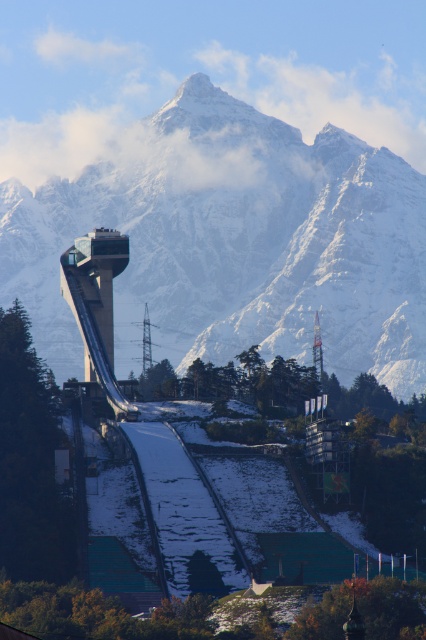
Is point (405, 163) positioned after point (175, 593)?

Yes, point (405, 163) is farther from viewer.

Between snowy granite mountain range at center and snowy white ski slope at center, which one is positioned higher?

snowy granite mountain range at center

Is point (296, 131) behind point (192, 589)?

Yes, point (296, 131) is farther from viewer.

Find the location of `snowy granite mountain range at center`. snowy granite mountain range at center is located at coordinates (238, 244).

Is snowy white ski slope at center to the left of metallic transmission tower at center from the viewer's perspective?

In fact, snowy white ski slope at center is to the right of metallic transmission tower at center.

Which is more to the right, snowy white ski slope at center or metallic transmission tower at center?

snowy white ski slope at center

I want to click on snowy white ski slope at center, so click(x=184, y=515).

Which is behind, point (5, 256) or point (117, 236)?

Positioned behind is point (5, 256).

Identify the location of snowy granite mountain range at center. (238, 244).